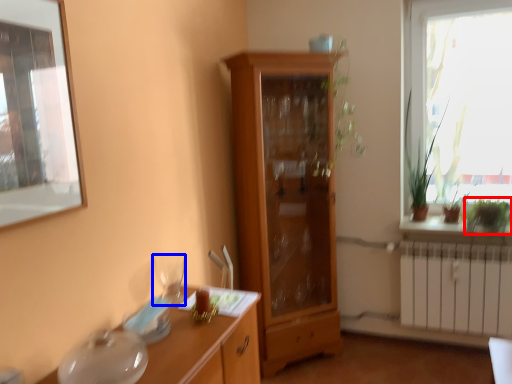
Question: Which object appears closest to the camera in this image, plant (highlighted by a red box) or tableware (highlighted by a blue box)?

Choices:
 (A) plant
 (B) tableware

Answer: (B)